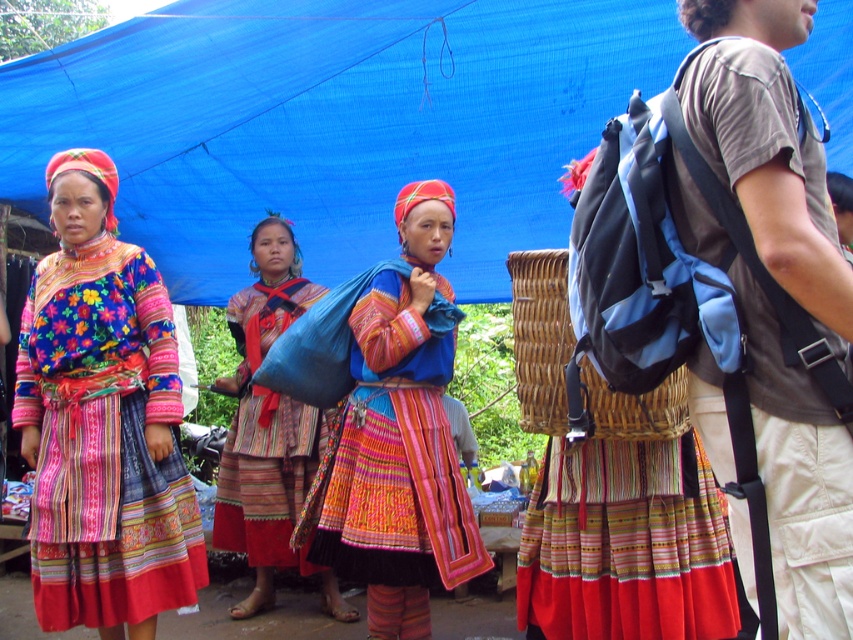
You are planning to hang a new decoration under the blue fabric canopy at upper center. You have a large decoration that is the same size as the textured woven bag at center. Will the canopy be able to support the decoration based on their sizes?

The blue fabric canopy at upper center has a larger size compared to the textured woven bag at center. Since the decoration is the same size as the bag, the canopy should be able to support it as it is bigger in size.

Consider the image. In the scene, you see a blue fabric canopy at upper center and a textured woven bag at center. Which object is located to the right of the other?

The blue fabric canopy at upper center is positioned on the right side of textured woven bag at center.